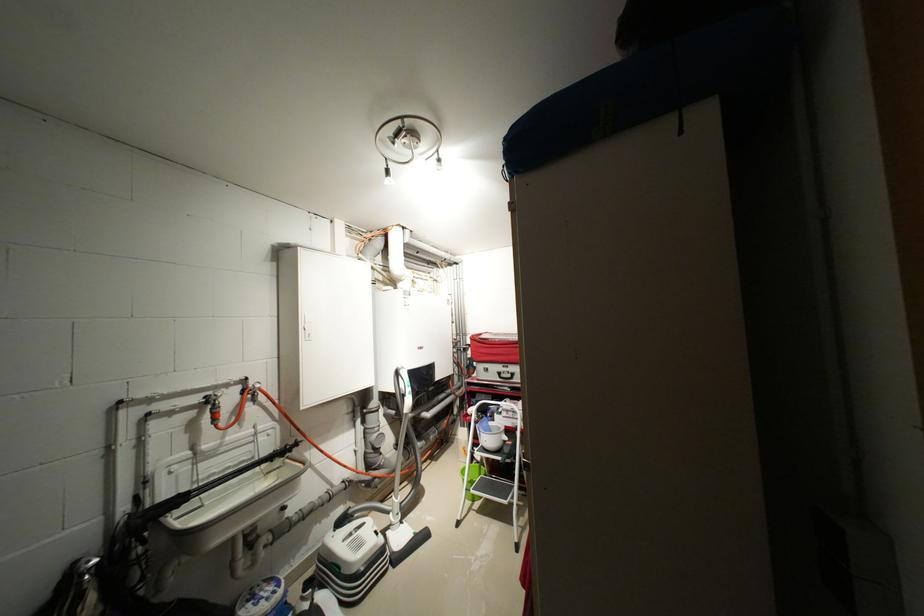
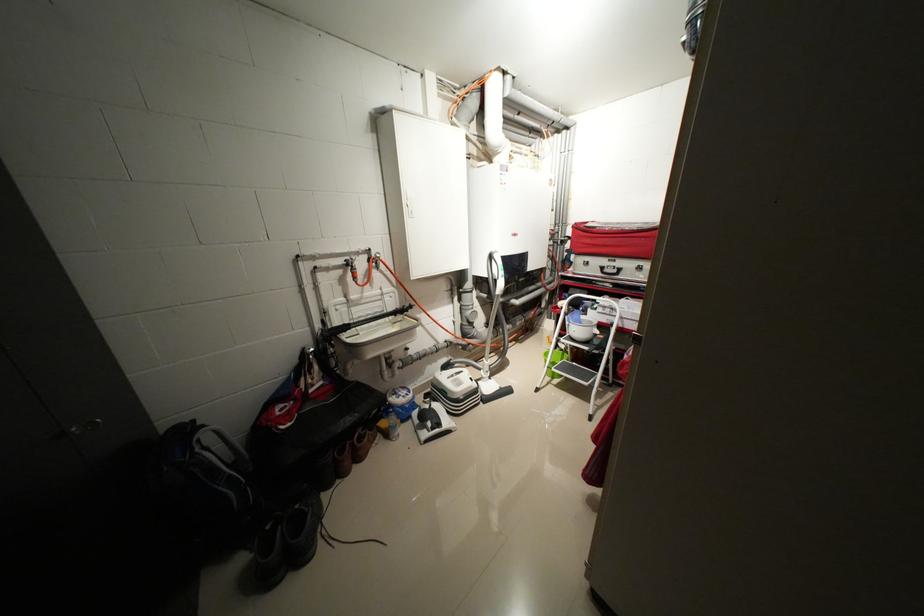
Based on the continuous images, in which direction is the camera rotating?

The camera's rotation is toward left-down.